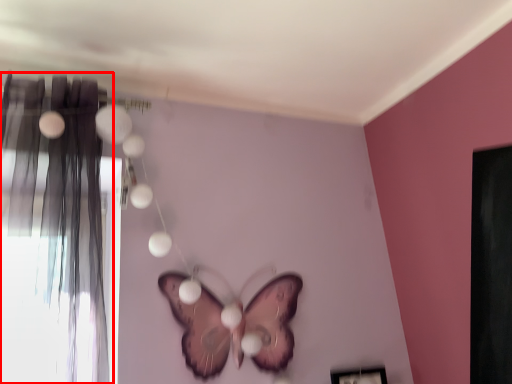
Question: Observing the image, what is the correct spatial positioning of curtain (annotated by the red box) in reference to butterfly?

Choices:
 (A) right
 (B) left

Answer: (B)